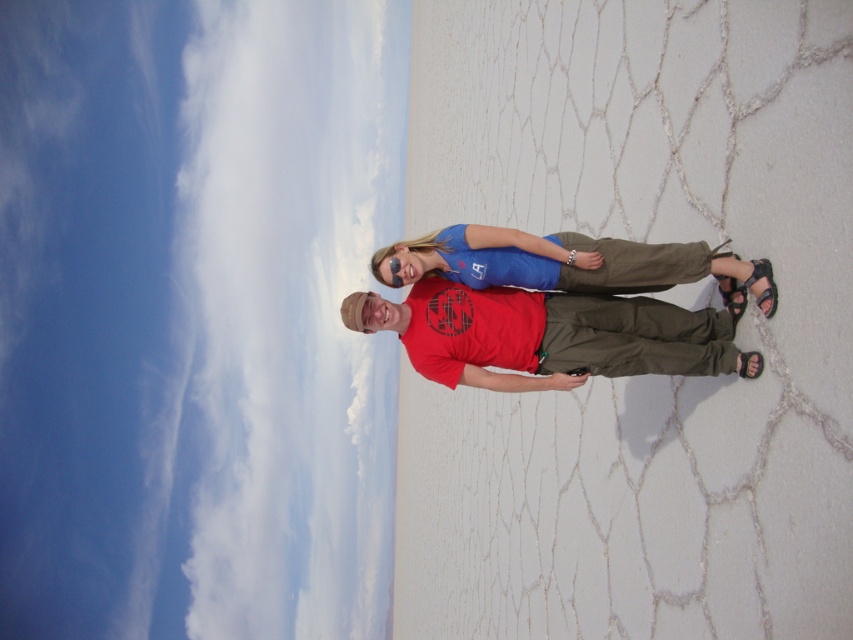
You are standing on the salt flat and want to walk from point A to point B. Point A is at coordinates point (538, 362) and point B is at point (747, 356). Which point is closer to you when you start at point A?

Point A is closer to you because it is the starting point. However, according to the description, point (538, 362) is further to the viewer than point (747, 356). This might mean that when moving from point A to point B, point B is actually closer in depth, but physically, you start at point A so it is your current position.